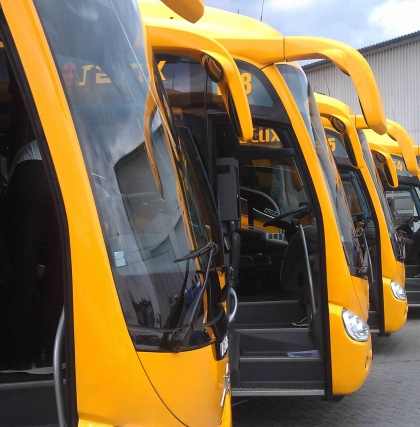
This screenshot has width=420, height=427. I want to click on yellow paint, so click(127, 381), click(343, 292), click(392, 276), click(390, 162), click(393, 147).